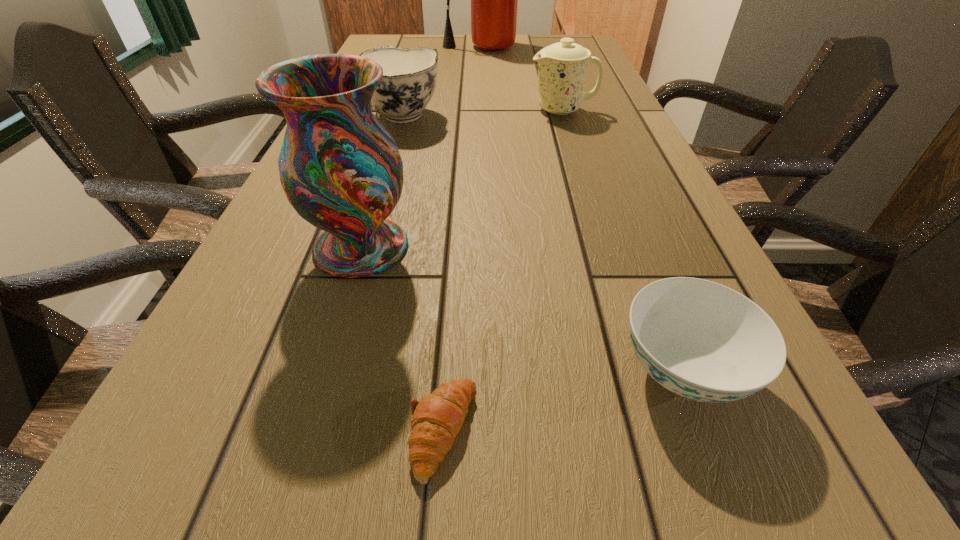
The image size is (960, 540). I want to click on the tallest object, so click(494, 0).

Where is `fire extinguisher`? The height and width of the screenshot is (540, 960). fire extinguisher is located at coordinates (494, 0).

The width and height of the screenshot is (960, 540). Identify the location of the fourth farthest object. (342, 172).

In order to click on vase in this screenshot , I will do pos(342,172).

At what (x,y) coordinates should I click in order to perform the action: click on the fourth shortest object. Please return your answer as a coordinate pair (x, y). This screenshot has height=540, width=960. Looking at the image, I should click on (562, 66).

Where is `the second tallest chinaware`? The image size is (960, 540). the second tallest chinaware is located at coordinates (x=409, y=75).

You are a GUI agent. You are given a task and a screenshot of the screen. Output one action in this format:
    pyautogui.click(x=<x>, y=<y>)
    Task: Click on the fourth tallest object
    
    Given the screenshot: What is the action you would take?
    pyautogui.click(x=409, y=75)

Identify the location of the fifth tallest object. (701, 340).

Locate an element on the screen. The height and width of the screenshot is (540, 960). the shortest chinaware is located at coordinates click(701, 340).

The height and width of the screenshot is (540, 960). I want to click on the shortest object, so click(x=437, y=419).